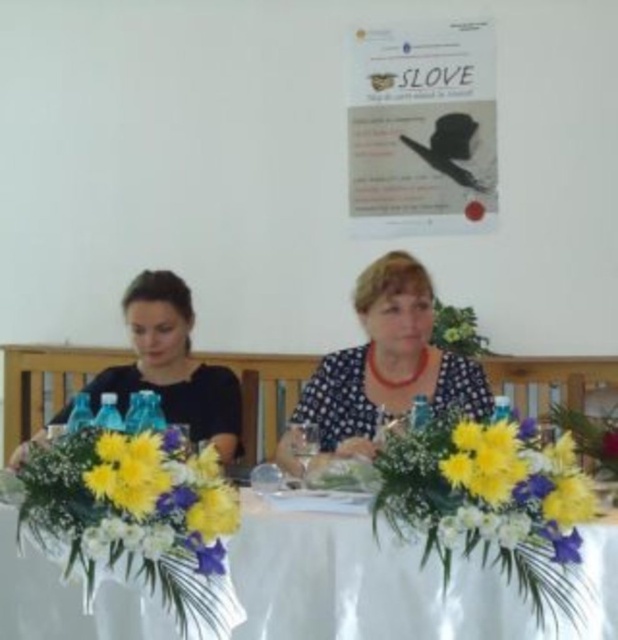
Question: Based on their relative distances, which object is farther from the yellow fabric flower bouquet at center?

Choices:
 (A) matte black dress at left
 (B) white cloth table at center
 (C) white floral arrangement at center
 (D) polka dot blouse at center

Answer: (A)

Question: Can you confirm if yellow fabric flower bouquet at center is wider than white floral arrangement at center?

Choices:
 (A) no
 (B) yes

Answer: (B)

Question: Which is farther from the matte black dress at left?

Choices:
 (A) white cloth table at center
 (B) yellow fabric flower bouquet at center
 (C) polka dot blouse at center

Answer: (B)

Question: Which point is closer to the camera?

Choices:
 (A) (540, 584)
 (B) (344, 518)
 (C) (180, 282)

Answer: (A)

Question: Can you confirm if white floral arrangement at center is smaller than polka dot blouse at center?

Choices:
 (A) no
 (B) yes

Answer: (B)

Question: Does white floral arrangement at center have a greater width compared to matte black dress at left?

Choices:
 (A) yes
 (B) no

Answer: (B)